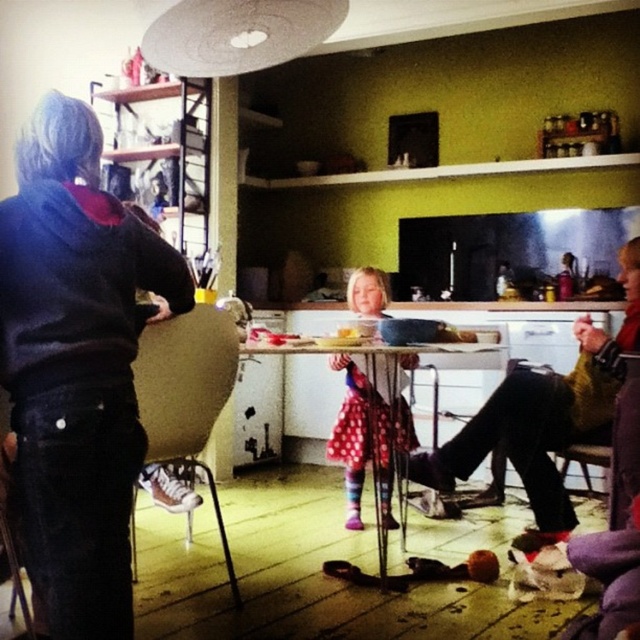
Can you confirm if dark blue corduroy pants at left is taller than polka dot dress at center?

Yes.

Is dark blue corduroy pants at left further to the viewer compared to polka dot dress at center?

No, dark blue corduroy pants at left is in front of polka dot dress at center.

Who is more forward, (28, 150) or (348, 499)?

Point (28, 150) is more forward.

The image size is (640, 640). I want to click on dark blue corduroy pants at left, so click(76, 365).

Between point (36, 154) and point (220, 342), which one is positioned behind?

Point (220, 342)

Does point (22, 461) come in front of point (173, 387)?

Yes, it is in front of point (173, 387).

Find the location of a particular element. This screenshot has width=640, height=640. dark blue corduroy pants at left is located at coordinates (76, 365).

Is point (209, 474) behind point (497, 480)?

No, (209, 474) is closer to viewer.

Measure the distance between point (180, 442) and camera.

Point (180, 442) is 2.31 meters away from camera.

The width and height of the screenshot is (640, 640). What are the coordinates of `brown fabric chair at lower left` in the screenshot? It's located at (188, 394).